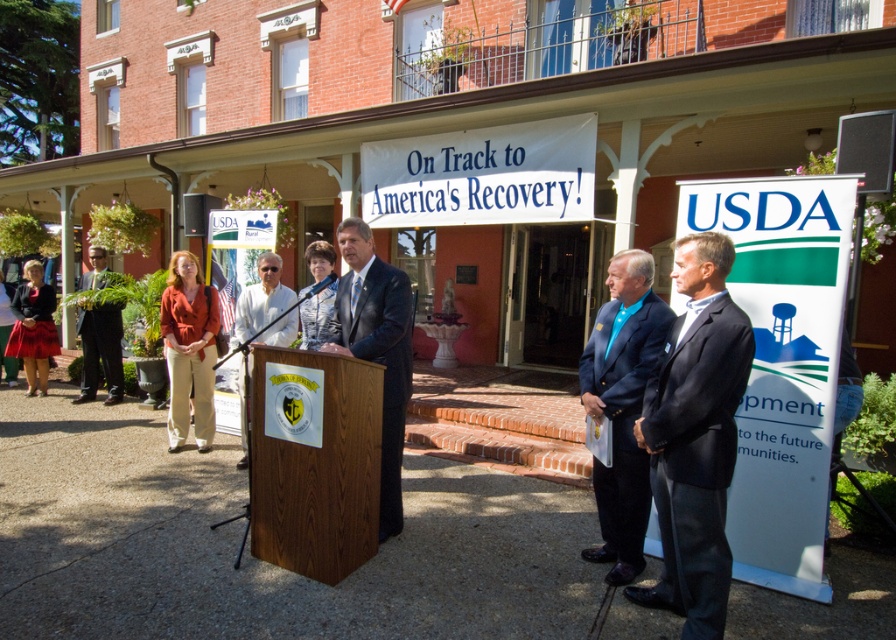
Question: Which point is farther from the camera taking this photo?

Choices:
 (A) (727, 358)
 (B) (36, 384)

Answer: (B)

Question: Is blue fabric suit at center positioned before white textured blouse at center?

Choices:
 (A) no
 (B) yes

Answer: (B)

Question: Which object appears farthest from the camera in this image?

Choices:
 (A) matte black jacket at lower left
 (B) dark suit at center
 (C) white matte shirt at center
 (D) white textured blouse at center

Answer: (A)

Question: Can you confirm if matte orange blazer at center is positioned to the left of white textured blouse at center?

Choices:
 (A) yes
 (B) no

Answer: (A)

Question: Which of the following is the farthest from the observer?

Choices:
 (A) (84, 342)
 (B) (338, 323)
 (C) (672, 436)
 (D) (197, 314)

Answer: (A)

Question: Is blue fabric suit at center positioned in front of matte black jacket at lower left?

Choices:
 (A) yes
 (B) no

Answer: (A)